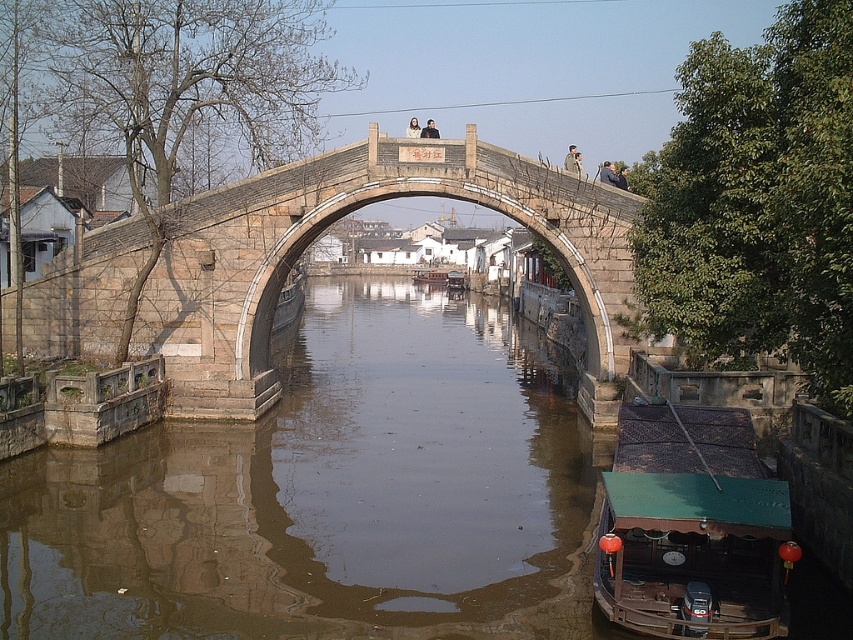
Question: Among these points, which one is farthest from the camera?

Choices:
 (A) (407, 134)
 (B) (621, 186)

Answer: (A)

Question: Which point is closer to the camera?

Choices:
 (A) light brown wooden sign at center
 (B) smooth skin face at upper center

Answer: (B)

Question: Is brown stone water at center positioned before smooth skin person at upper center?

Choices:
 (A) no
 (B) yes

Answer: (B)

Question: Can you confirm if brown stone water at center is positioned to the right of dark gray fabric jacket at upper center?

Choices:
 (A) yes
 (B) no

Answer: (B)

Question: Which is nearer to the smooth skin person at upper center?

Choices:
 (A) smooth skin face at upper center
 (B) dark gray fabric jacket at upper center
 (C) brown stone water at center
 (D) green canvas boat at lower right

Answer: (A)

Question: Can you confirm if light brown wooden bridge at center is bigger than smooth skin face at upper center?

Choices:
 (A) no
 (B) yes

Answer: (B)